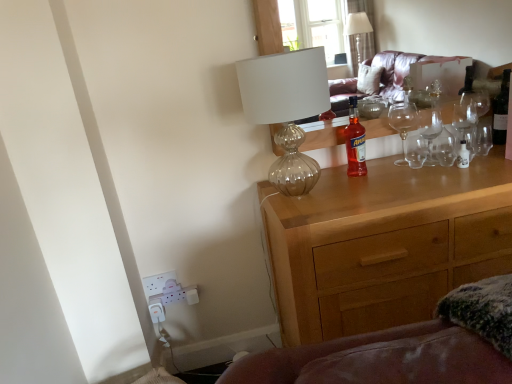
At what (x,y) coordinates should I click in order to perform the action: click on vacant point to the left of dark glass wine bottle at upper right. Please return your answer as a coordinate pair (x, y). This screenshot has height=384, width=512. Looking at the image, I should click on (483, 157).